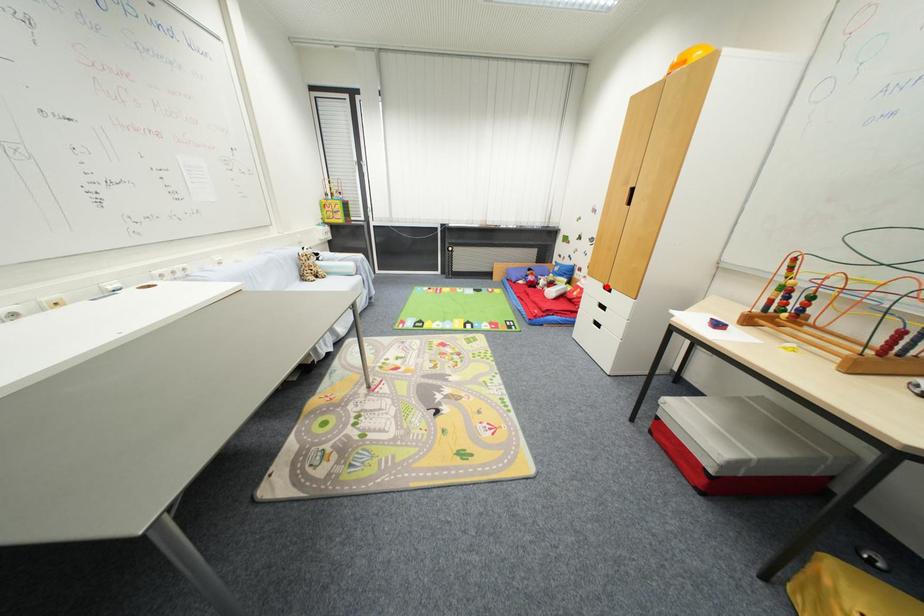
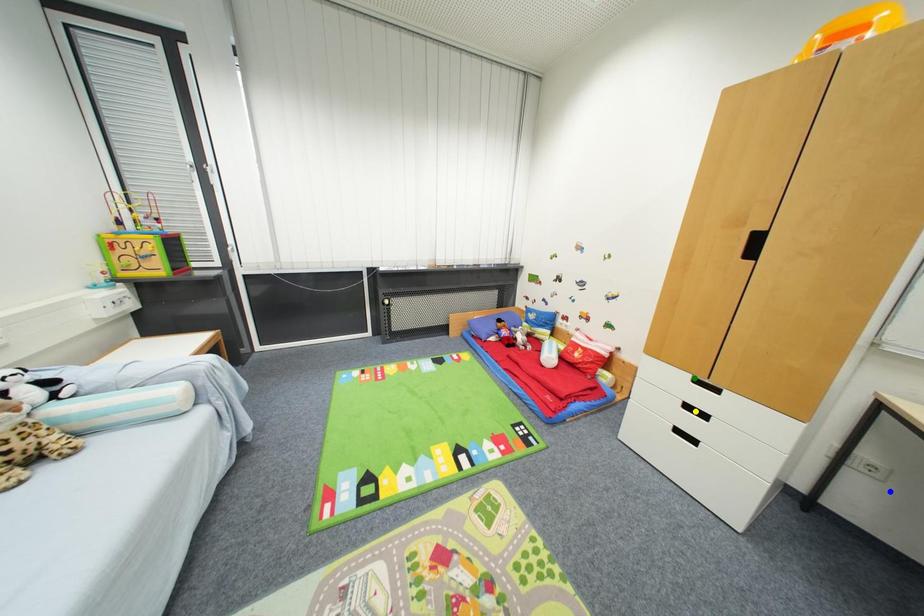
Question: I am providing you with two images of the same scene from different viewpoints. A red point is marked on the first image. You are given multiple points on the second image. Which mark in image 2 goes with the point in image 1?

Choices:
 (A) yellow point
 (B) green point
 (C) blue point

Answer: (B)